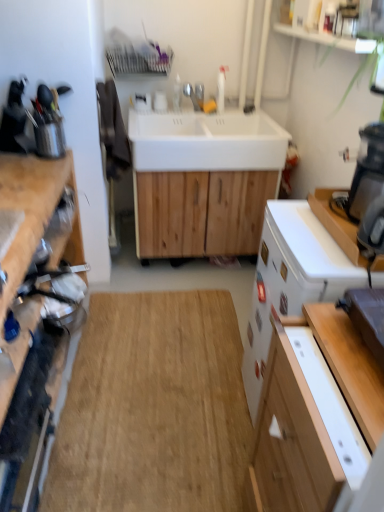
At what (x,y) coordinates should I click in order to perform the action: click on free space in front of metallic silver knife block at left. Please return your answer as a coordinate pair (x, y). This screenshot has width=384, height=512. Looking at the image, I should click on (18, 162).